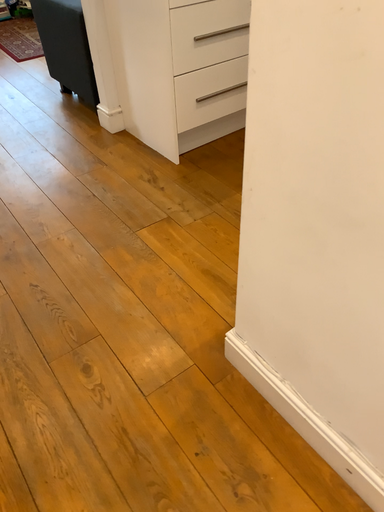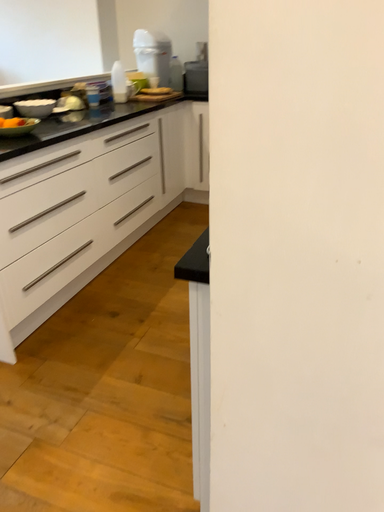
Question: Which way did the camera rotate in the video?

Choices:
 (A) rotated right
 (B) rotated left

Answer: (A)